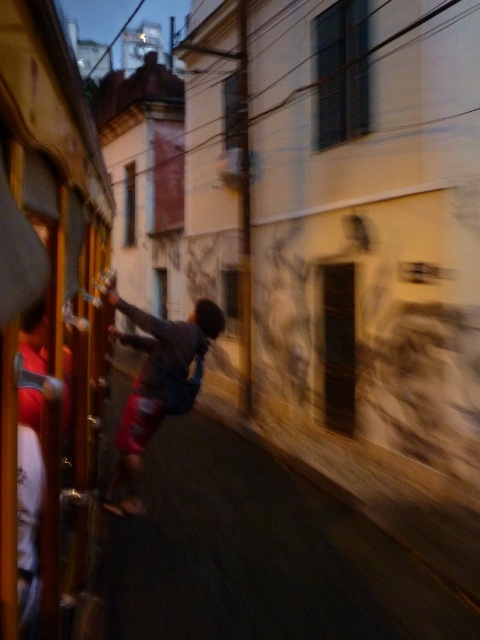
Which is in front, point (202, 358) or point (233, 333)?

Point (202, 358)

Is point (219, 317) positioned after point (226, 294)?

No.

Where is `light gray fabric shirt at center`? Image resolution: width=480 pixels, height=640 pixels. light gray fabric shirt at center is located at coordinates (154, 385).

Based on the photo, does clear glass window at center have a greater width compared to smooth glass window at center?

No, clear glass window at center is not wider than smooth glass window at center.

Which of these two, clear glass window at center or smooth glass window at center, stands taller?

Answer: smooth glass window at center is taller.

Describe the element at coordinates (231, 300) in the screenshot. I see `clear glass window at center` at that location.

This screenshot has height=640, width=480. Find the location of `clear glass window at center`. clear glass window at center is located at coordinates (231, 300).

Who is lower down, light gray fabric shirt at center or dark glass window at upper center?

light gray fabric shirt at center is lower down.

What do you see at coordinates (154, 385) in the screenshot? I see `light gray fabric shirt at center` at bounding box center [154, 385].

This screenshot has width=480, height=640. What are the coordinates of `light gray fabric shirt at center` in the screenshot? It's located at (154, 385).